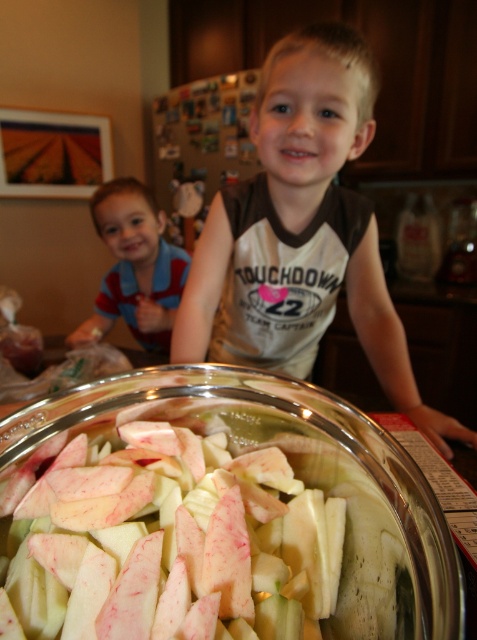
Question: Which of the following is the farthest from the observer?

Choices:
 (A) striped shirt at left
 (B) clear glass bowl at center
 (C) white cotton shirt at center

Answer: (A)

Question: Considering the real-world distances, which object is farthest from the white cotton shirt at center?

Choices:
 (A) striped shirt at left
 (B) clear glass bowl at center

Answer: (A)

Question: From the image, what is the correct spatial relationship of white cotton shirt at center in relation to striped shirt at left?

Choices:
 (A) left
 (B) right

Answer: (B)

Question: Is clear glass bowl at center positioned in front of white cotton shirt at center?

Choices:
 (A) no
 (B) yes

Answer: (B)

Question: Does white cotton shirt at center appear on the left side of striped shirt at left?

Choices:
 (A) yes
 (B) no

Answer: (B)

Question: Based on their relative distances, which object is nearer to the clear glass bowl at center?

Choices:
 (A) white cotton shirt at center
 (B) striped shirt at left

Answer: (A)